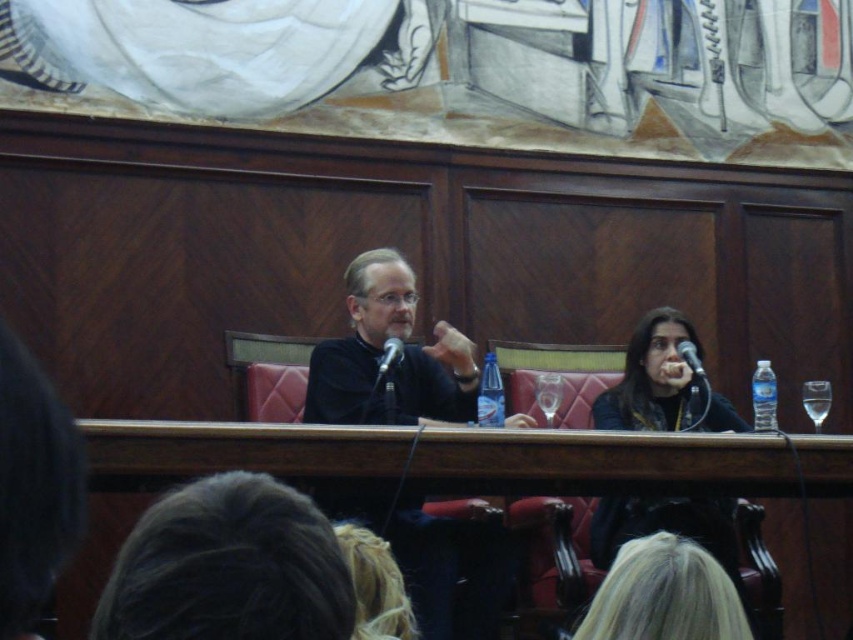
Question: Estimate the real-world distances between objects in this image. Which object is farther from the black matte microphone at center?

Choices:
 (A) blonde hair at upper center
 (B) black fabric at center
 (C) matte black shirt at center
 (D) wooden table at center

Answer: (A)

Question: Does wooden table at center have a larger size compared to black fabric at center?

Choices:
 (A) yes
 (B) no

Answer: (A)

Question: Does black fabric at center have a greater width compared to blonde hair at upper center?

Choices:
 (A) no
 (B) yes

Answer: (B)

Question: Among these points, which one is farthest from the camera?

Choices:
 (A) (393, 289)
 (B) (392, 368)

Answer: (A)

Question: Is the position of wooden table at center more distant than that of black matte microphone at center?

Choices:
 (A) no
 (B) yes

Answer: (A)

Question: Which is farther from the blonde hair at upper center?

Choices:
 (A) black matte microphone at center
 (B) wooden table at center

Answer: (A)